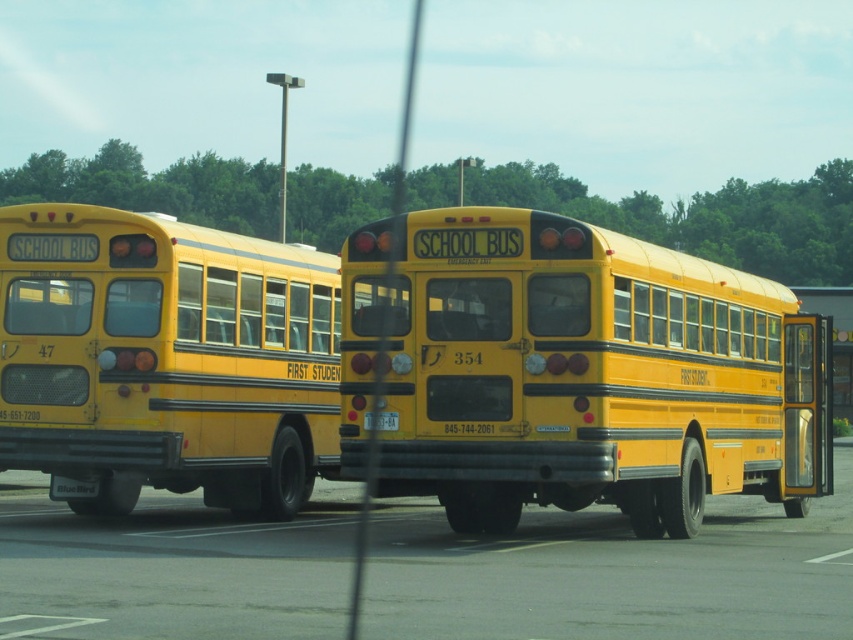
You are standing at the front of the two yellow school buses parked side by side. You notice two points marked on the ground. The first point is at coordinate point[532,353] and the second point is at coordinate point[666,634]. If you were to walk from the first point to the second point, would you be moving towards the front or the rear of the buses?

The point[532,353] is behind point[666,634]. Therefore, moving from the first point to the second point would mean walking towards the front of the buses since you are moving from a position behind to one in front.